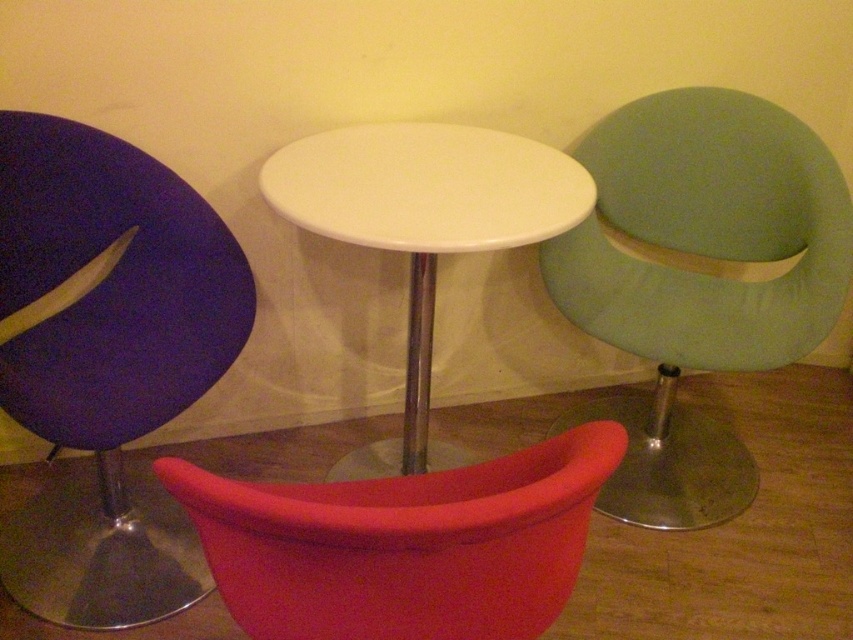
Between matte purple chair at left and matte red swivel chair at lower center, which one has more height?

matte purple chair at left

Does point (100, 156) lie in front of point (363, 548)?

That is False.

Describe the element at coordinates (108, 365) in the screenshot. The image size is (853, 640). I see `matte purple chair at left` at that location.

Find the location of a particular element. The height and width of the screenshot is (640, 853). matte purple chair at left is located at coordinates (108, 365).

What do you see at coordinates (698, 280) in the screenshot?
I see `matte green armchair at right` at bounding box center [698, 280].

Between matte green armchair at right and matte red swivel chair at lower center, which one appears on the right side from the viewer's perspective?

matte green armchair at right is more to the right.

Is point (786, 275) closer to camera compared to point (325, 637)?

That is False.

You are a GUI agent. You are given a task and a screenshot of the screen. Output one action in this format:
    pyautogui.click(x=<x>, y=<y>)
    Task: Click on the matte green armchair at right
    
    Given the screenshot: What is the action you would take?
    pyautogui.click(x=698, y=280)

Can you confirm if matte purple chair at left is bigger than white glossy side table at center?

No.

Does matte purple chair at left appear under white glossy side table at center?

Yes, matte purple chair at left is below white glossy side table at center.

I want to click on matte purple chair at left, so click(108, 365).